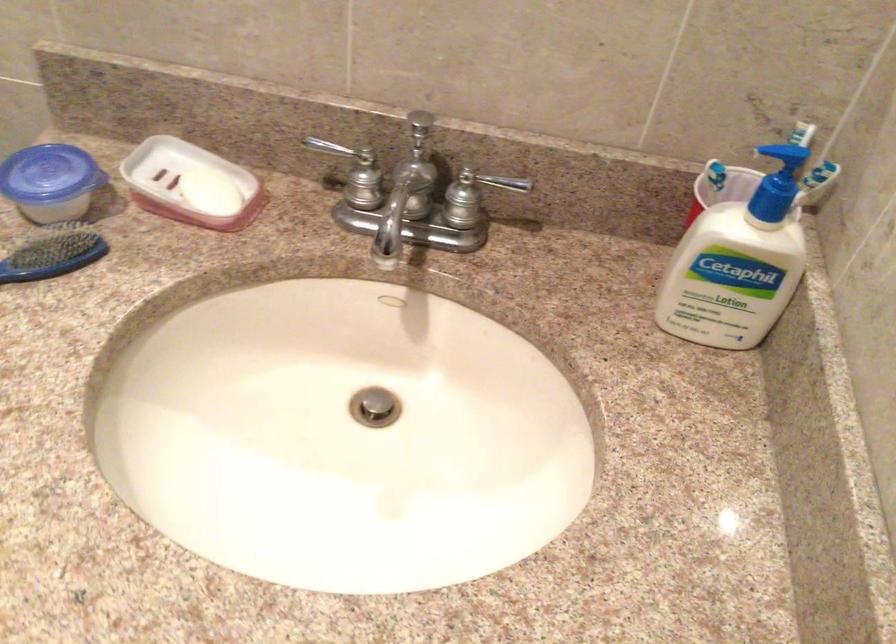
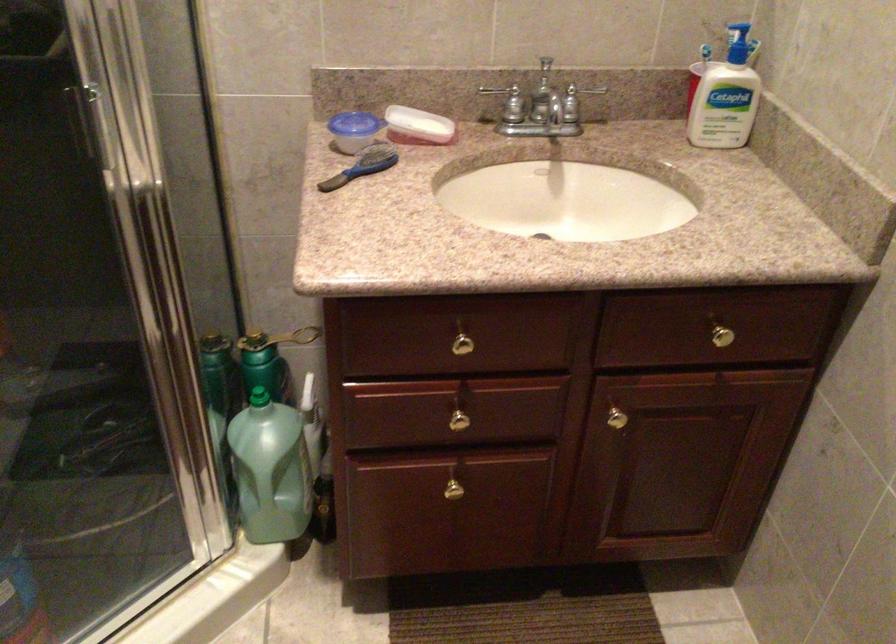
In the second image, find the point that corresponds to (x=356, y=174) in the first image.

(509, 102)